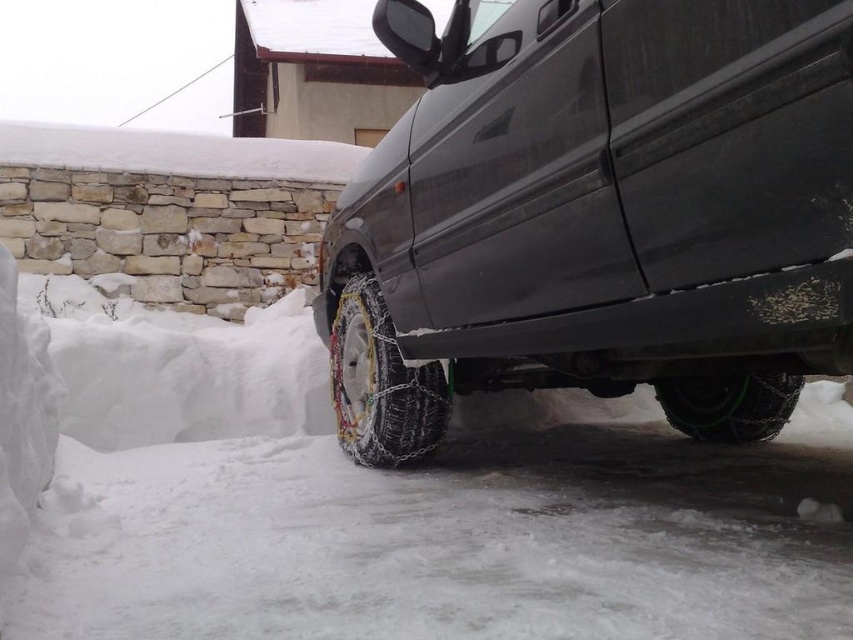
Question: Which point is farther to the camera?

Choices:
 (A) (741, 397)
 (B) (712, 129)
 (C) (370, 419)

Answer: (A)

Question: Which is farther from the matte black van at center?

Choices:
 (A) green rubber tire at lower right
 (B) metallic chain-link tire at lower center

Answer: (A)

Question: Observing the image, what is the correct spatial positioning of matte black van at center in reference to metallic chain-link tire at lower center?

Choices:
 (A) above
 (B) below

Answer: (A)

Question: Is matte black van at center bigger than metallic chain-link tire at lower center?

Choices:
 (A) no
 (B) yes

Answer: (B)

Question: Which point is farther to the camera?

Choices:
 (A) (334, 321)
 (B) (723, 397)
 (C) (840, 49)

Answer: (B)

Question: Is metallic chain-link tire at lower center positioned before green rubber tire at lower right?

Choices:
 (A) yes
 (B) no

Answer: (A)